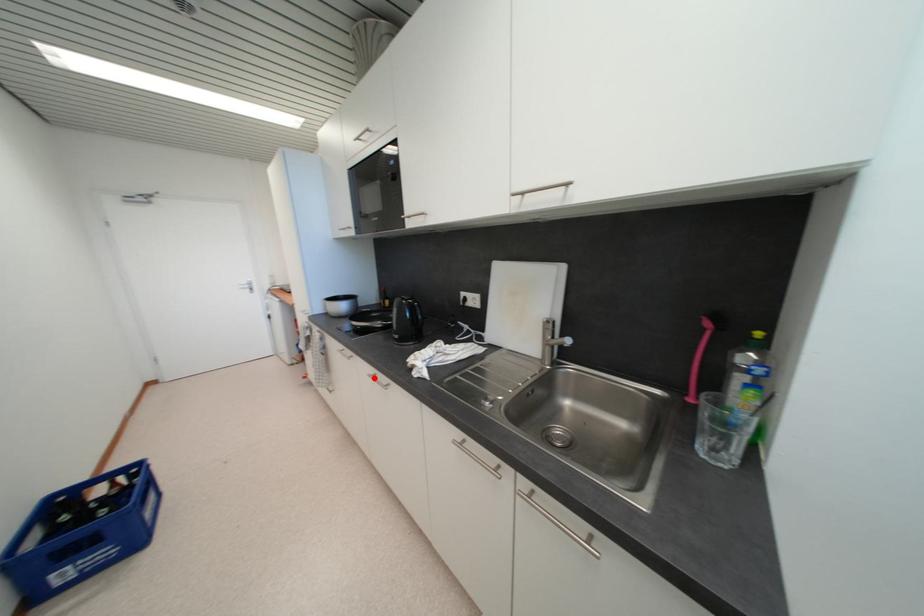
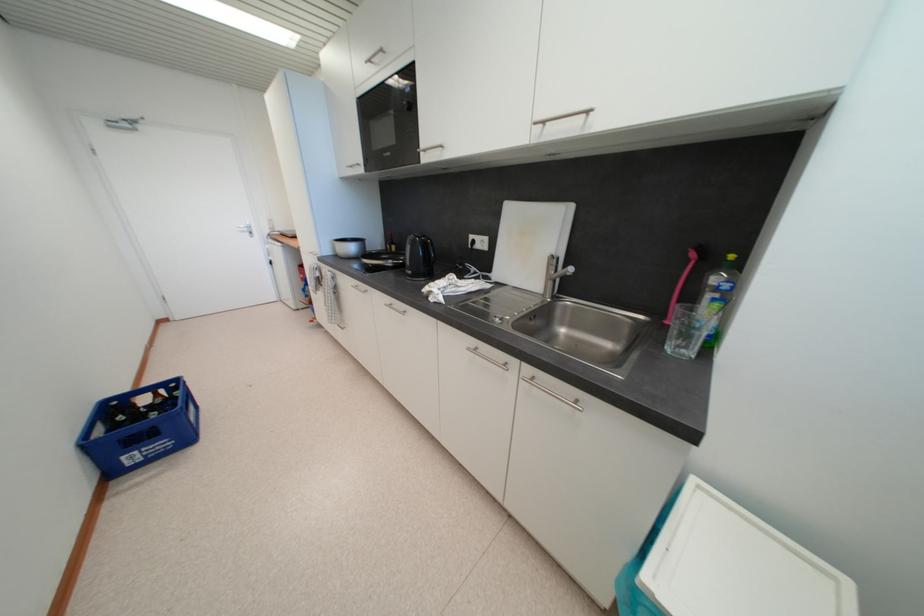
In the second image, find the point that corresponds to the highlighted location in the first image.

(391, 307)